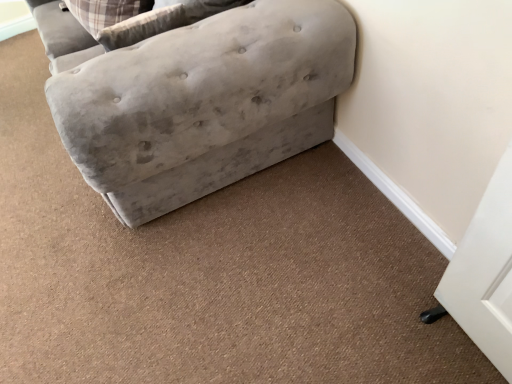
Find the location of a particular element. velvet gray couch at upper left is located at coordinates (204, 103).

The image size is (512, 384). Describe the element at coordinates (204, 103) in the screenshot. I see `velvet gray couch at upper left` at that location.

In order to face velvet gray couch at upper left, should I rotate leftwards or rightwards?

To face it directly, rotate left by 13.957 degrees.

Locate an element on the screen. The height and width of the screenshot is (384, 512). velvet gray couch at upper left is located at coordinates (204, 103).